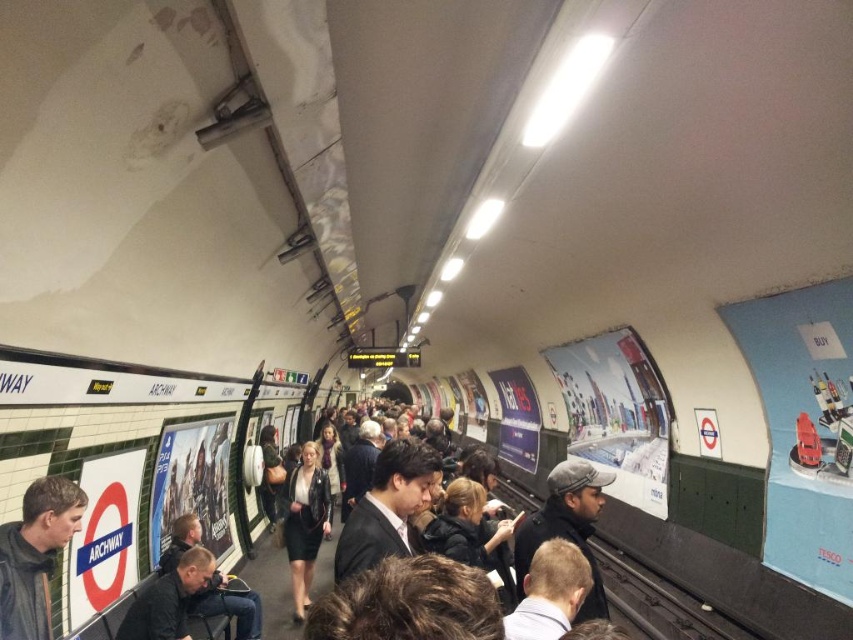
Does dark suit at center have a greater width compared to dark gray wool hat at center?

No, dark suit at center is not wider than dark gray wool hat at center.

Is point (392, 492) farther from camera compared to point (573, 509)?

No, (392, 492) is in front of (573, 509).

Who is more distant from viewer, [403,452] or [592,557]?

The point [592,557] is behind.

The image size is (853, 640). I want to click on dark suit at center, so 386,508.

Does dark gray jacket at lower left appear over dark gray wool hat at center?

Yes, dark gray jacket at lower left is above dark gray wool hat at center.

Can you confirm if dark gray jacket at lower left is positioned to the right of dark gray wool hat at center?

In fact, dark gray jacket at lower left is to the left of dark gray wool hat at center.

Is point (25, 612) more distant than point (529, 541)?

No, (25, 612) is in front of (529, 541).

Identify the location of dark gray jacket at lower left. (x=35, y=554).

Is dark gray jacket at lower left further to the viewer compared to dark suit at center?

No, it is in front of dark suit at center.

Is point (51, 544) closer to camera compared to point (367, 531)?

No, (51, 544) is further to viewer.

Which is in front, point (53, 481) or point (396, 513)?

Positioned in front is point (53, 481).

Find the location of a particular element. The height and width of the screenshot is (640, 853). dark gray jacket at lower left is located at coordinates (35, 554).